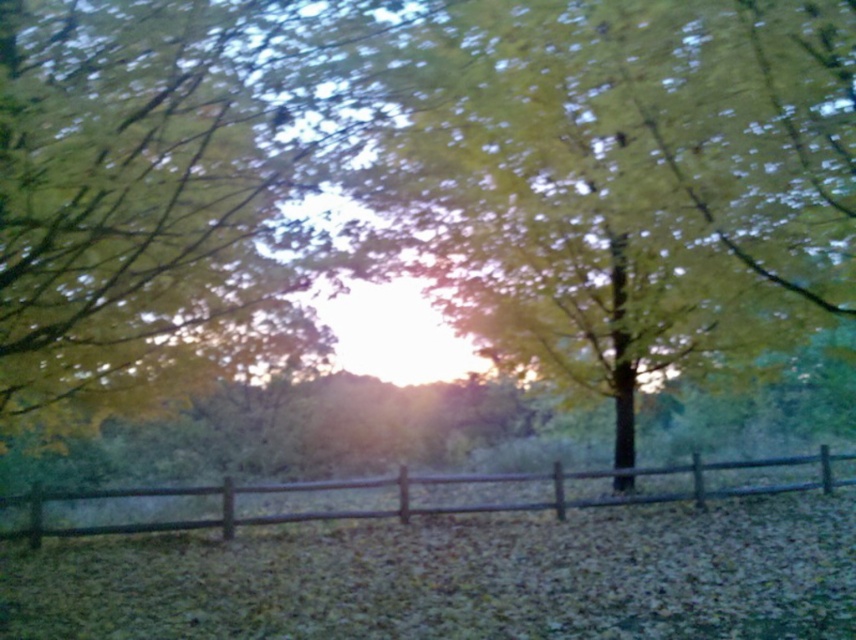
Is green matte tree at center taller than brown wooden fence at lower center?

Yes, green matte tree at center is taller than brown wooden fence at lower center.

Which is in front, point (421, 148) or point (779, 464)?

Positioned in front is point (421, 148).

At what (x,y) coordinates should I click in order to perform the action: click on green matte tree at center. Please return your answer as a coordinate pair (x, y). The height and width of the screenshot is (640, 856). Looking at the image, I should click on (629, 179).